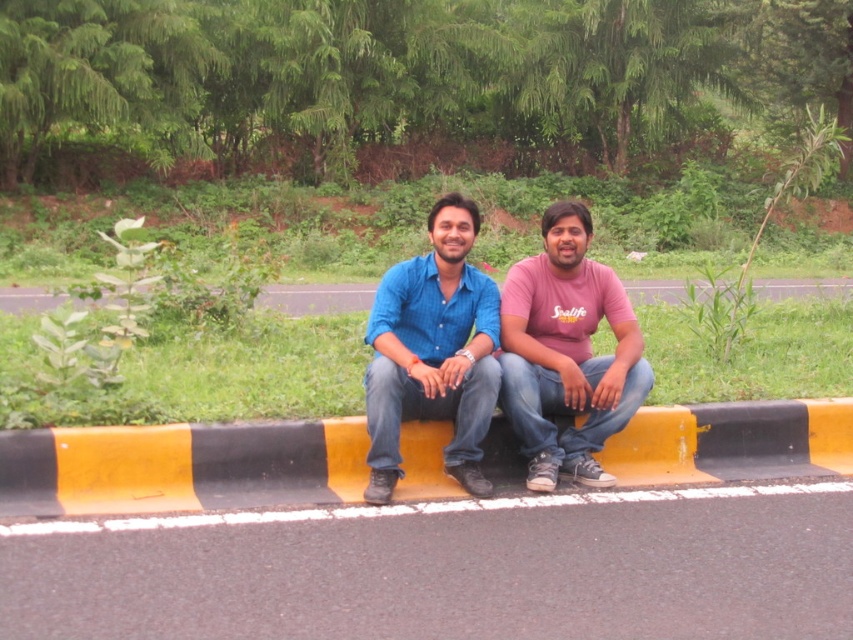
You are standing at the point with coordinates point (512, 396) and want to walk towards the point with coordinates point (419, 440). Which direction should you move to get closer to your destination?

You should move towards the viewer because point (419, 440) is closer to the viewer than point (512, 396).

You are a photographer trying to capture a closeup of the two people sitting on the curb. You want to ensure both are in focus. Given their positions at point (418, 433) and point (428, 404), which point should you focus on to maximize the chances of both being sharp?

You should focus on point (418, 433) because it is further from the camera than point (428, 404). By focusing on the further point, the depth of field will include the closer subject as well, ensuring both are in focus.